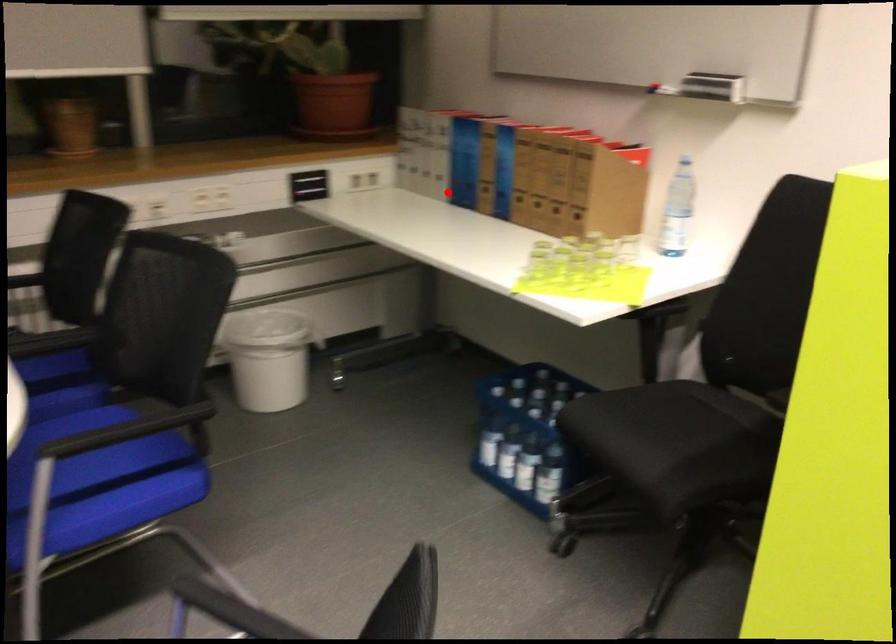
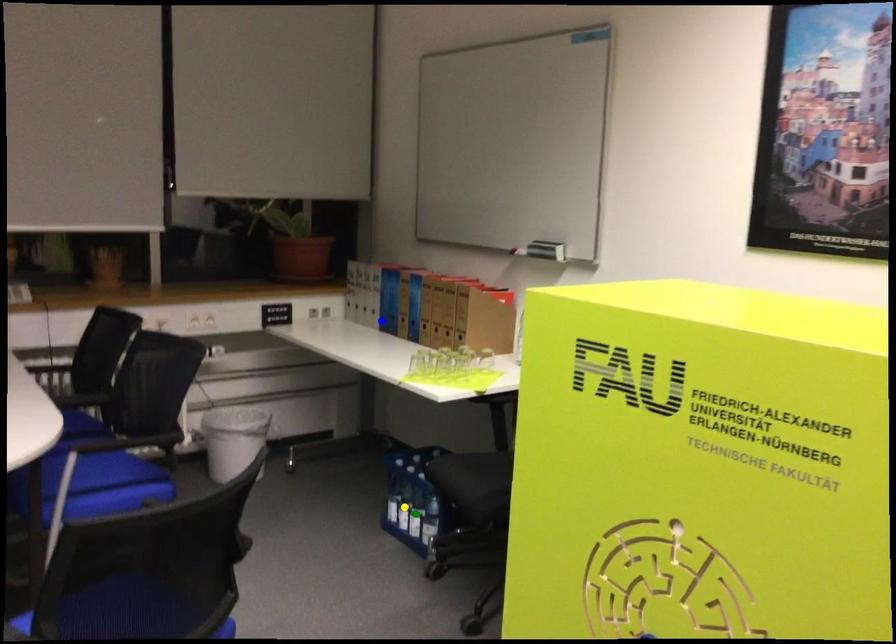
Question: I am providing you with two images of the same scene from different viewpoints. A red point is marked on the first image. You are given multiple points on the second image. Can you choose the point in image 2 that corresponds to the point in image 1?

Choices:
 (A) blue point
 (B) green point
 (C) yellow point

Answer: (A)